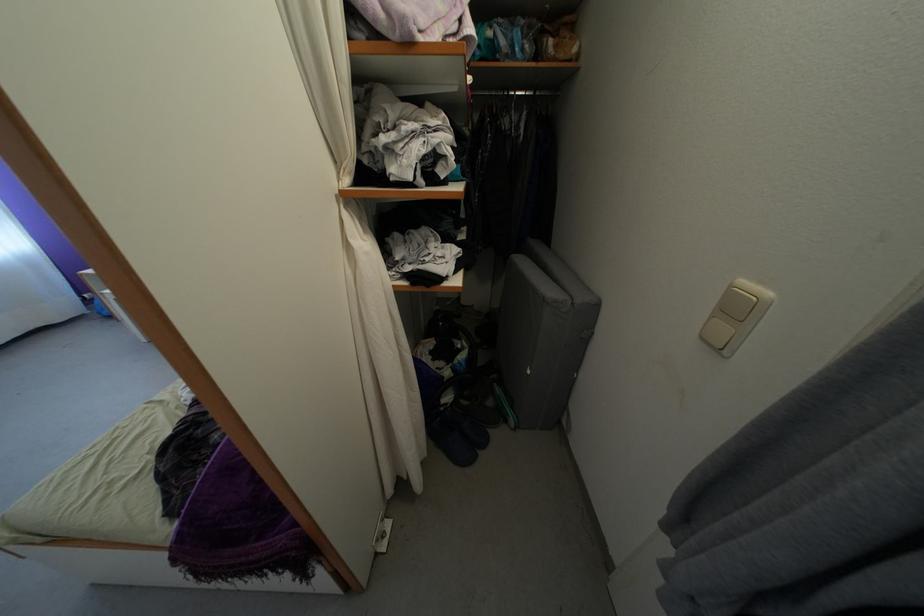
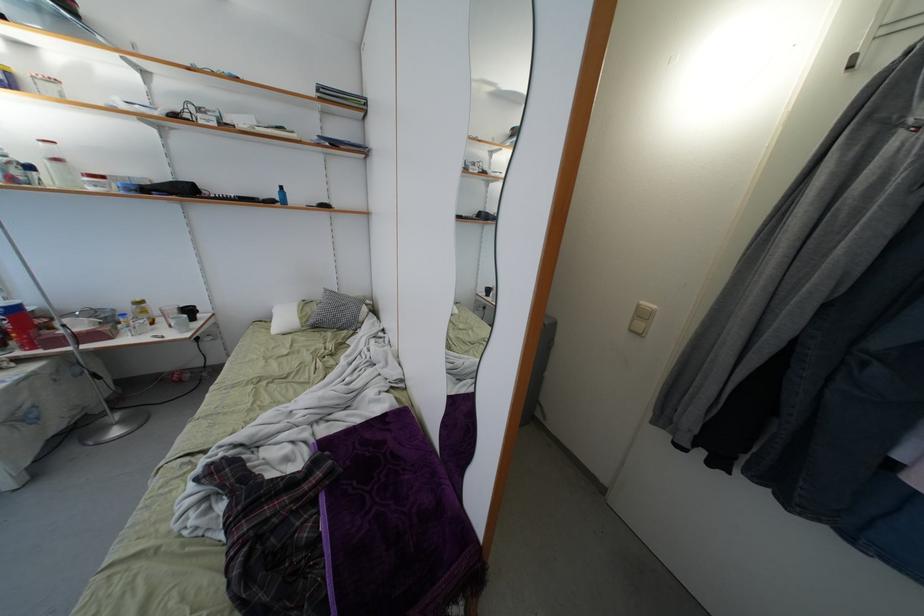
Question: How did the camera likely rotate?

Choices:
 (A) Left
 (B) Right
 (C) Up
 (D) Down

Answer: (B)